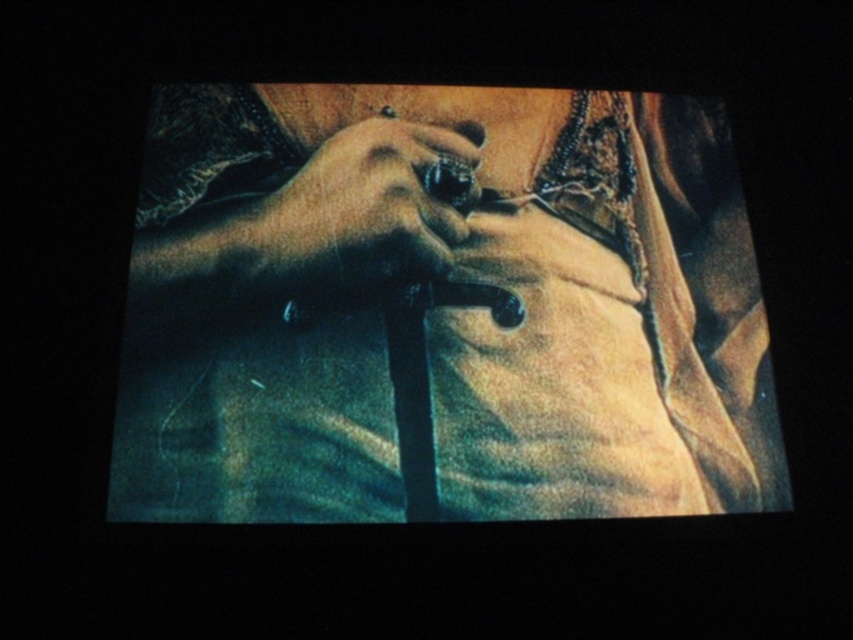
Question: Does matte black cane at center have a larger size compared to smooth leather glove at center?

Choices:
 (A) yes
 (B) no

Answer: (A)

Question: Which point is closer to the camera taking this photo?

Choices:
 (A) click(x=317, y=244)
 (B) click(x=587, y=104)

Answer: (A)

Question: Can you confirm if matte black cane at center is bigger than smooth leather glove at center?

Choices:
 (A) yes
 (B) no

Answer: (A)

Question: Can you confirm if matte black cane at center is smaller than smooth leather glove at center?

Choices:
 (A) yes
 (B) no

Answer: (B)

Question: Which point is closer to the camera?

Choices:
 (A) (363, 196)
 (B) (271, 392)

Answer: (B)

Question: Among these points, which one is farthest from the camera?

Choices:
 (A) (534, 257)
 (B) (419, 152)

Answer: (B)